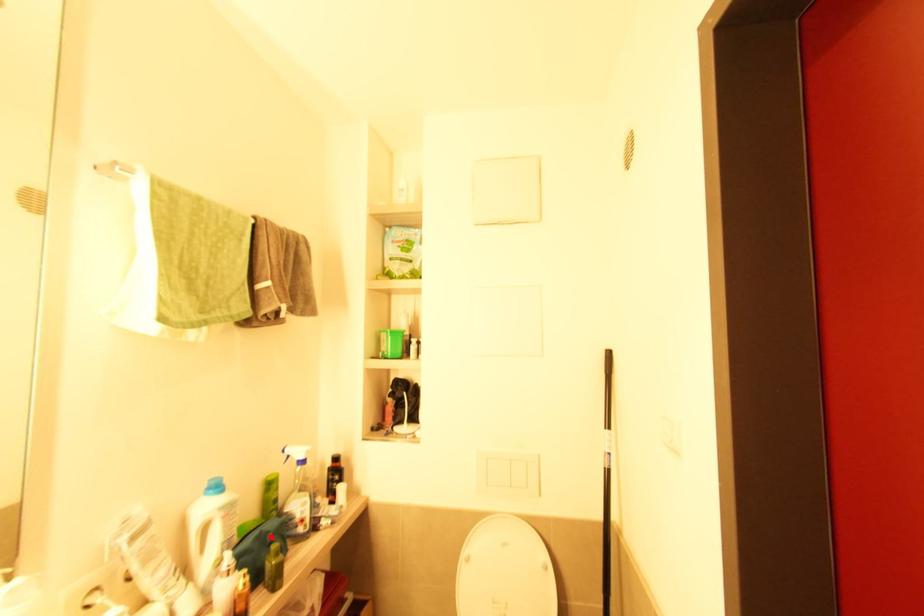
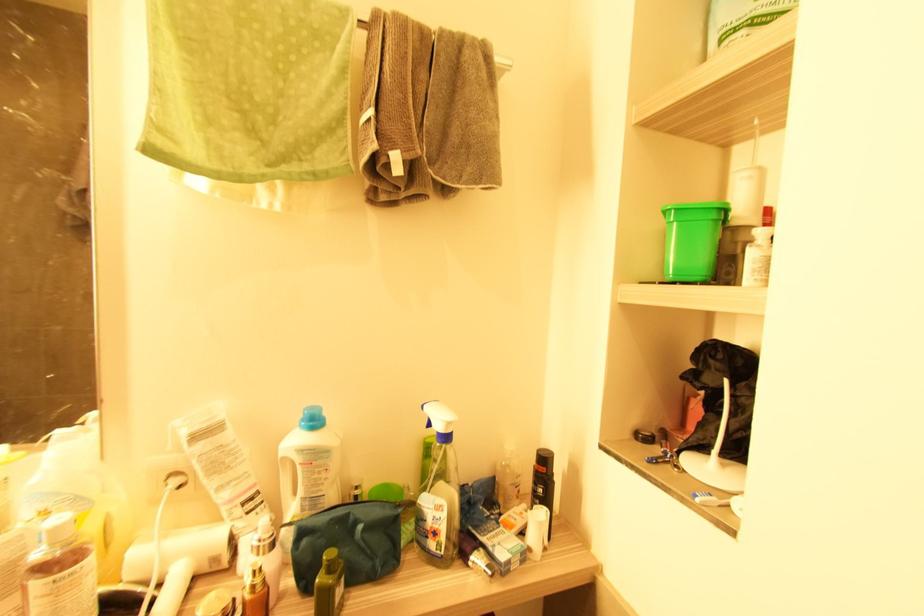
Question: I am providing you with two images of the same scene from different viewpoints. A red point is marked on the first image. At the location where the point appears in image 1, is it still visible in image 2?

Choices:
 (A) Yes
 (B) No

Answer: (A)